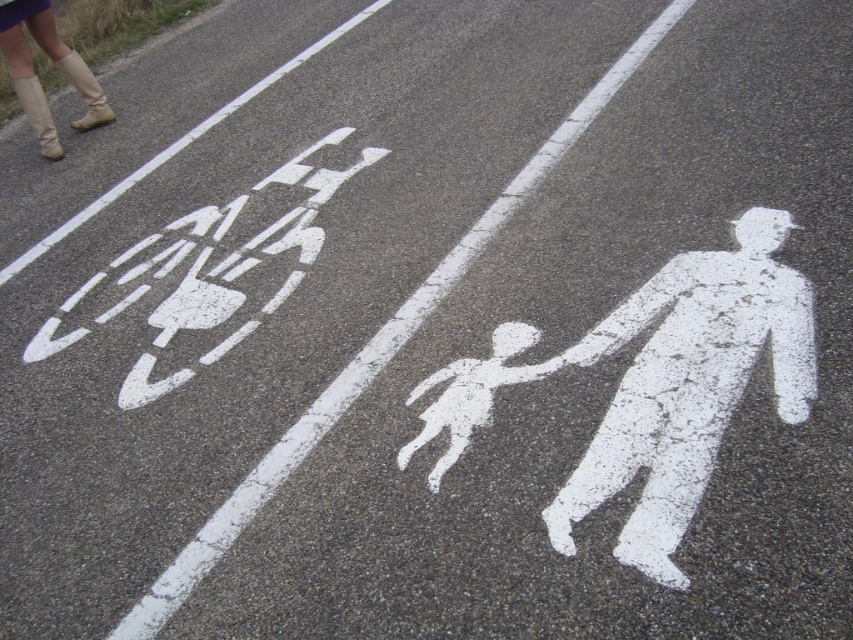
You are a delivery person trying to navigate a busy street. You see the white matte pedestrian at center and the beige leather boots at upper left. Which object is closer to you as you approach the road?

The white matte pedestrian at center is in front of the beige leather boots at upper left, so the white matte pedestrian at center is closer to you as you approach the road.

You are a pedestrian trying to cross the road and see the white chalk figure at center and the beige leather boots at upper left. Which object appears larger in the image?

The beige leather boots at upper left appears larger than the white chalk figure at center in the image.